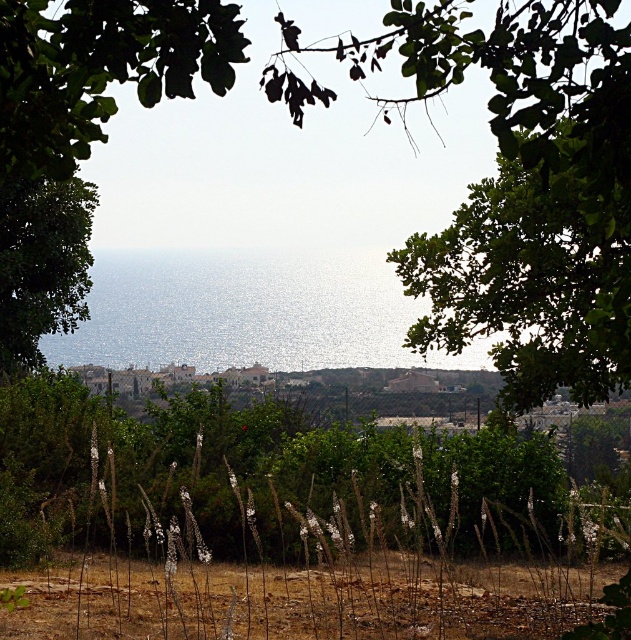
Describe the element at coordinates (295, 604) in the screenshot. I see `brown dry soil at lower center` at that location.

Between point (310, 616) and point (44, 252), which one is positioned behind?

Positioned behind is point (44, 252).

Between point (382, 572) and point (80, 275), which one is positioned in front?

Point (382, 572) is in front.

I want to click on brown dry soil at lower center, so click(295, 604).

Who is positioned more to the right, shiny blue water at center or green leafy tree at left?

shiny blue water at center is more to the right.

Does point (244, 307) lie behind point (42, 179)?

Yes, it is behind point (42, 179).

Is point (244, 300) positioned before point (68, 228)?

No, (244, 300) is behind (68, 228).

I want to click on shiny blue water at center, so click(x=247, y=312).

Is green leafy tree at upper right wider than shiny blue water at center?

No.

Identify the location of green leafy tree at upper right. (533, 276).

Is point (447, 340) in front of point (86, 326)?

Yes, it is in front of point (86, 326).

The width and height of the screenshot is (631, 640). Find the location of `green leafy tree at upper right`. green leafy tree at upper right is located at coordinates (533, 276).